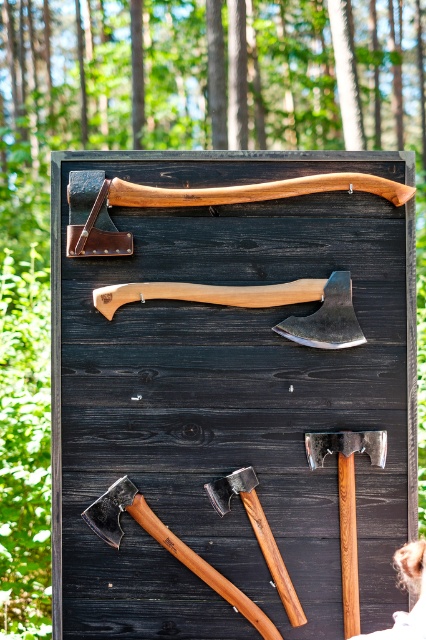
Between wooden axe at lower right and polished wood hammer at lower center, which one is positioned lower?

Positioned lower is polished wood hammer at lower center.

Is wooden axe at lower right bigger than polished wood hammer at lower center?

Yes, wooden axe at lower right is bigger than polished wood hammer at lower center.

Find the location of `wooden axe at lower right`. wooden axe at lower right is located at coordinates (347, 502).

Which is more to the left, wooden handle axe at lower center or wooden axe at lower right?

From the viewer's perspective, wooden handle axe at lower center appears more on the left side.

Which is in front, point (172, 534) or point (351, 627)?

Point (172, 534) is more forward.

Locate an element on the screen. wooden handle axe at lower center is located at coordinates (167, 547).

Find the location of a particular element. Image resolution: width=426 pixels, height=640 pixels. wooden handle at top is located at coordinates (227, 380).